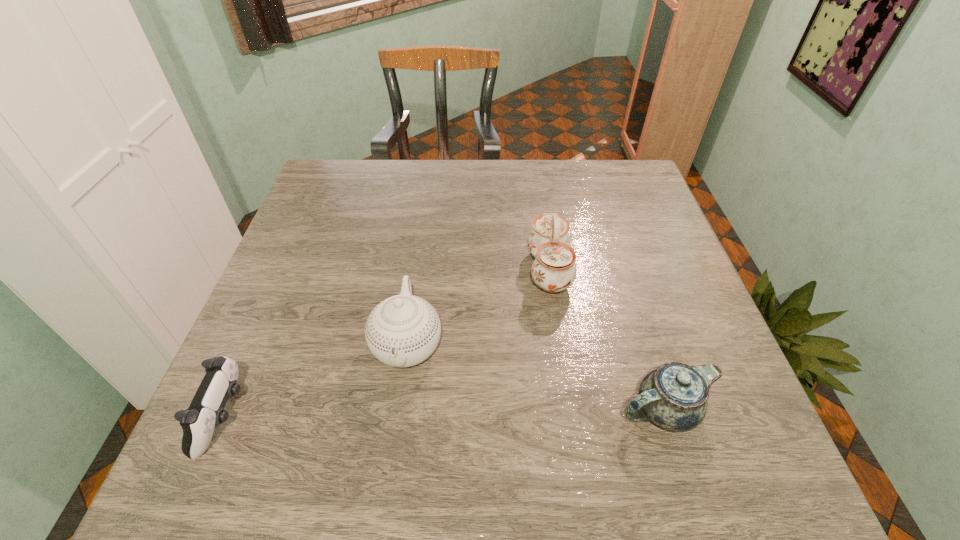
Locate an element on the screen. vacant area between the farthest chinaware and the rightmost object is located at coordinates (607, 340).

Identify the location of vacant region between the shortest chinaware and the third object from right to left. (536, 377).

The image size is (960, 540). Identify the location of free spot between the farthest object and the rightmost chinaware. (607, 340).

Identify the location of free spot between the rightmost chinaware and the farthest object. (607, 340).

This screenshot has height=540, width=960. Find the location of `vacant point located between the control and the shortest chinaware`. vacant point located between the control and the shortest chinaware is located at coordinates (444, 413).

Point out which object is positioned as the nearest to the leftmost chinaware. Please provide its 2D coordinates. Your answer should be formatted as a tuple, i.e. [(x, y)], where the tuple contains the x and y coordinates of a point satisfying the conditions above.

[(554, 269)]

The height and width of the screenshot is (540, 960). In order to click on the second closest object to the control in this screenshot , I will do `click(554, 269)`.

Image resolution: width=960 pixels, height=540 pixels. Find the location of `chinaware that is the third closest to the control`. chinaware that is the third closest to the control is located at coordinates (674, 397).

Choose which chinaware is the third nearest neighbor to the control. Please provide its 2D coordinates. Your answer should be formatted as a tuple, i.e. [(x, y)], where the tuple contains the x and y coordinates of a point satisfying the conditions above.

[(674, 397)]

Locate an element on the screen. The image size is (960, 540). free spot that satisfies the following two spatial constraints: 1. on the spout of the second object from left to right; 2. on the front-facing side of the leftmost object is located at coordinates (397, 417).